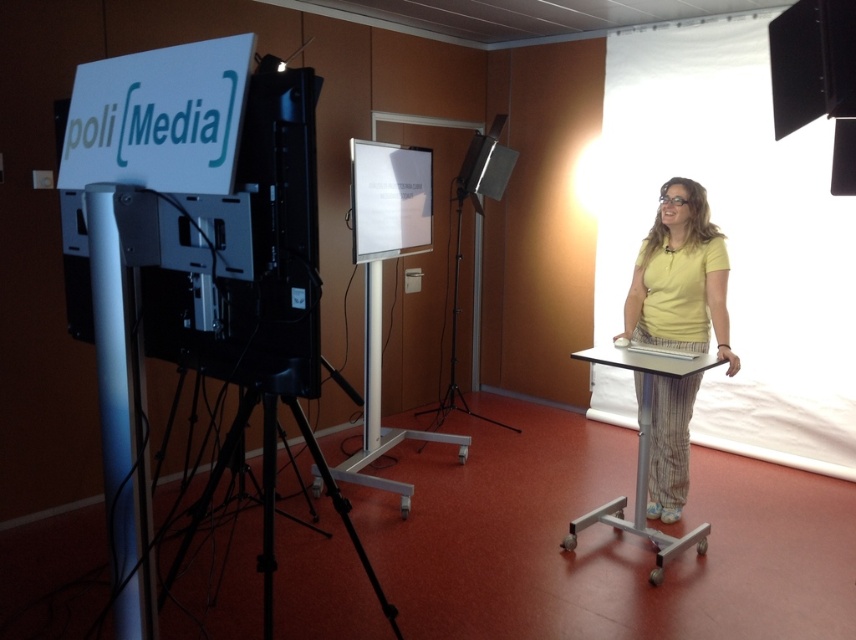
Looking at this image, does black matte tripod at lower left appear on the right side of black matte tripod at center?

No, black matte tripod at lower left is not to the right of black matte tripod at center.

Does black matte tripod at lower left have a greater height compared to black matte tripod at center?

No, black matte tripod at lower left is not taller than black matte tripod at center.

Which is behind, point (203, 497) or point (456, 236)?

The point (456, 236) is more distant.

The image size is (856, 640). I want to click on black matte tripod at lower left, so click(x=262, y=497).

Does white matte sign at upper left appear under black matte tripod at center?

No, white matte sign at upper left is not below black matte tripod at center.

Who is more forward, (161, 108) or (428, 410)?

Point (161, 108) is more forward.

What do you see at coordinates (158, 116) in the screenshot? Image resolution: width=856 pixels, height=640 pixels. I see `white matte sign at upper left` at bounding box center [158, 116].

Image resolution: width=856 pixels, height=640 pixels. In order to click on white matte sign at upper left in this screenshot , I will do `click(158, 116)`.

Does white matte sign at upper left have a lesser width compared to white glossy projection screen at center?

Incorrect, white matte sign at upper left's width is not less than white glossy projection screen at center's.

How far apart are white matte sign at upper left and white glossy projection screen at center?

The distance of white matte sign at upper left from white glossy projection screen at center is 2.20 meters.

You are a GUI agent. You are given a task and a screenshot of the screen. Output one action in this format:
    pyautogui.click(x=<x>, y=<y>)
    Task: Click on the white matte sign at upper left
    
    Given the screenshot: What is the action you would take?
    pyautogui.click(x=158, y=116)